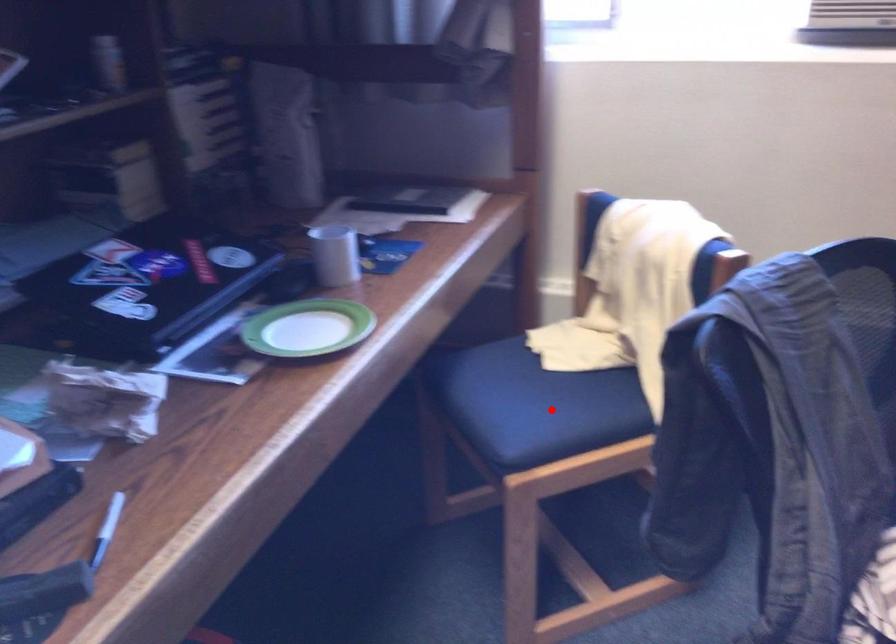
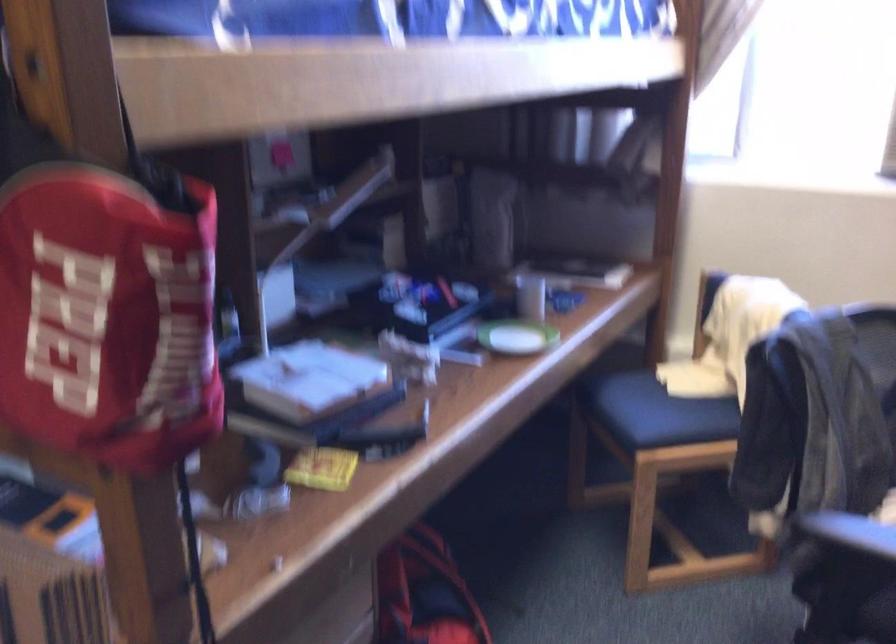
The point at the highlighted location is marked in the first image. Where is the corresponding point in the second image?

(668, 415)